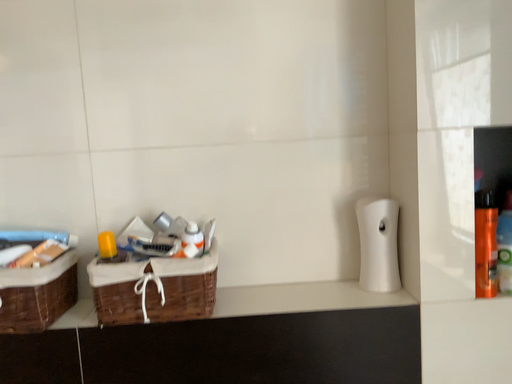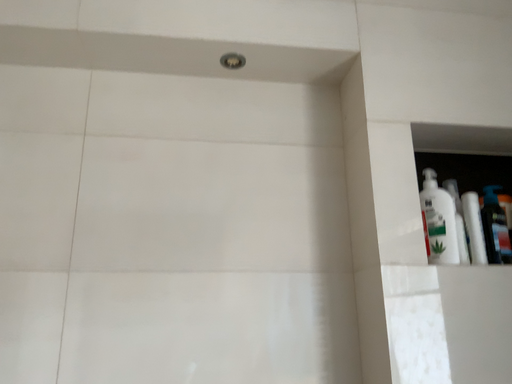
Question: How did the camera likely rotate when shooting the video?

Choices:
 (A) rotated left
 (B) rotated right

Answer: (B)